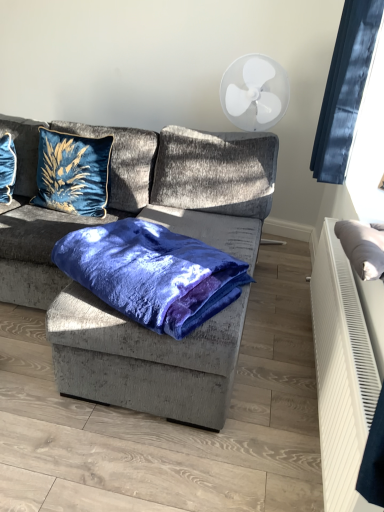
Question: Is black fabric at upper right not within gray fabric pillow at right, which ranks as the 3th pillow in left-to-right order?

Choices:
 (A) no
 (B) yes

Answer: (B)

Question: Is gray fabric pillow at right, which appears as the third pillow when viewed from the back, a part of black fabric at upper right?

Choices:
 (A) yes
 (B) no

Answer: (B)

Question: From a real-world perspective, is black fabric at upper right below gray fabric pillow at right, which ranks as the 3th pillow in left-to-right order?

Choices:
 (A) yes
 (B) no

Answer: (B)

Question: Is black fabric at upper right positioned with its back to gray fabric pillow at right, which ranks as the 1th pillow in front-to-back order?

Choices:
 (A) no
 (B) yes

Answer: (A)

Question: Is black fabric at upper right closer to camera compared to gray fabric pillow at right, which ranks as the 3th pillow in left-to-right order?

Choices:
 (A) no
 (B) yes

Answer: (A)

Question: Are black fabric at upper right and gray fabric pillow at right, which ranks as the 3th pillow in left-to-right order, making contact?

Choices:
 (A) yes
 (B) no

Answer: (B)

Question: Can you confirm if black fabric at upper right is positioned to the left of velvet blue blanket at center?

Choices:
 (A) yes
 (B) no

Answer: (B)

Question: From the image's perspective, would you say black fabric at upper right is shown under velvet blue blanket at center?

Choices:
 (A) no
 (B) yes

Answer: (A)

Question: Is velvet blue blanket at center completely or partially inside black fabric at upper right?

Choices:
 (A) yes
 (B) no

Answer: (B)

Question: Can we say black fabric at upper right lies outside velvet blue blanket at center?

Choices:
 (A) no
 (B) yes

Answer: (B)

Question: Is black fabric at upper right taller than velvet blue blanket at center?

Choices:
 (A) yes
 (B) no

Answer: (A)

Question: From a real-world perspective, does black fabric at upper right sit lower than velvet blue blanket at center?

Choices:
 (A) yes
 (B) no

Answer: (B)

Question: Is velvet blue blanket at center not inside gray fabric pillow at right, the 1th pillow positioned from the right?

Choices:
 (A) no
 (B) yes

Answer: (B)